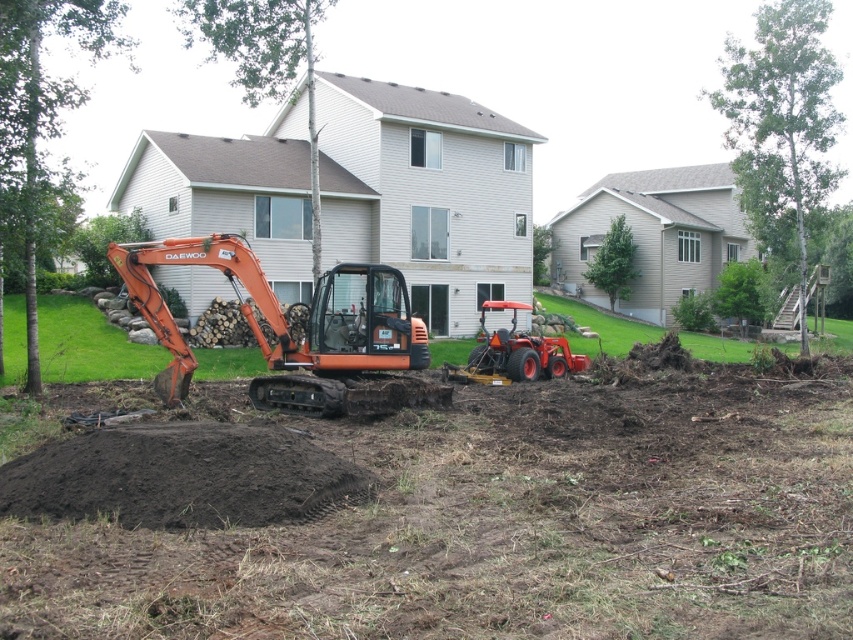
Does orange rubber excavator at center have a greater width compared to dark brown soil at center?

Correct, the width of orange rubber excavator at center exceeds that of dark brown soil at center.

Between orange rubber excavator at center and dark brown soil at center, which one has more height?

Standing taller between the two is orange rubber excavator at center.

Measure the distance between point (x=781, y=627) and camera.

Point (x=781, y=627) is 4.77 meters away from camera.

Identify the location of orange rubber excavator at center. (500, 524).

Consider the image. Who is higher up, dark brown soil at center or orange rubber tractor at center?

orange rubber tractor at center is above.

Can you confirm if dark brown soil at center is positioned to the right of orange rubber tractor at center?

Incorrect, dark brown soil at center is not on the right side of orange rubber tractor at center.

At what (x,y) coordinates should I click in order to perform the action: click on dark brown soil at center. Please return your answer as a coordinate pair (x, y). This screenshot has width=853, height=640. Looking at the image, I should click on (181, 476).

Between orange rubber excavator at center and orange rubber tractor at center, which one has more height?

orange rubber excavator at center

Is orange rubber excavator at center below orange rubber tractor at center?

Correct, orange rubber excavator at center is located below orange rubber tractor at center.

Locate an element on the screen. Image resolution: width=853 pixels, height=640 pixels. orange rubber excavator at center is located at coordinates (500, 524).

At what (x,y) coordinates should I click in order to perform the action: click on orange rubber excavator at center. Please return your answer as a coordinate pair (x, y). The width and height of the screenshot is (853, 640). Looking at the image, I should click on [500, 524].